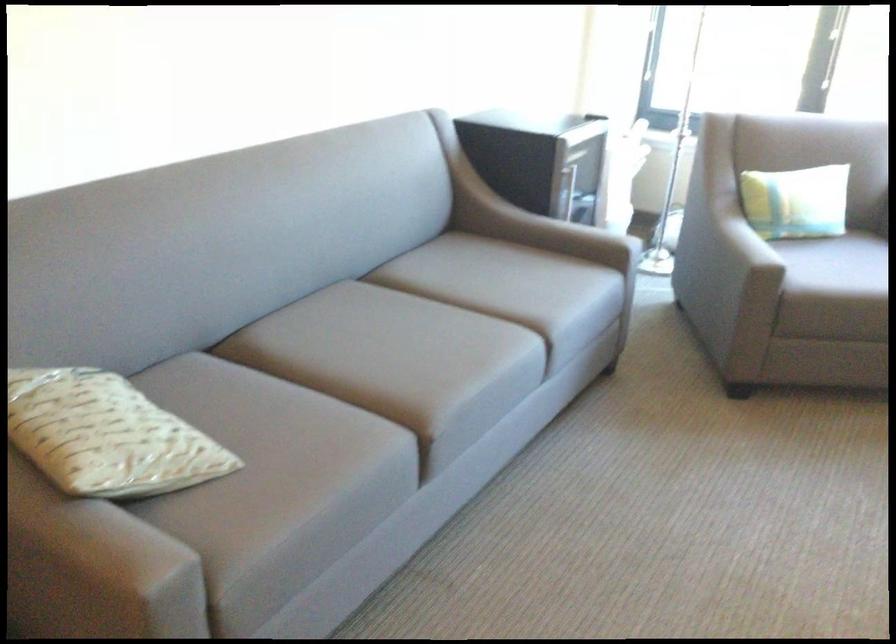
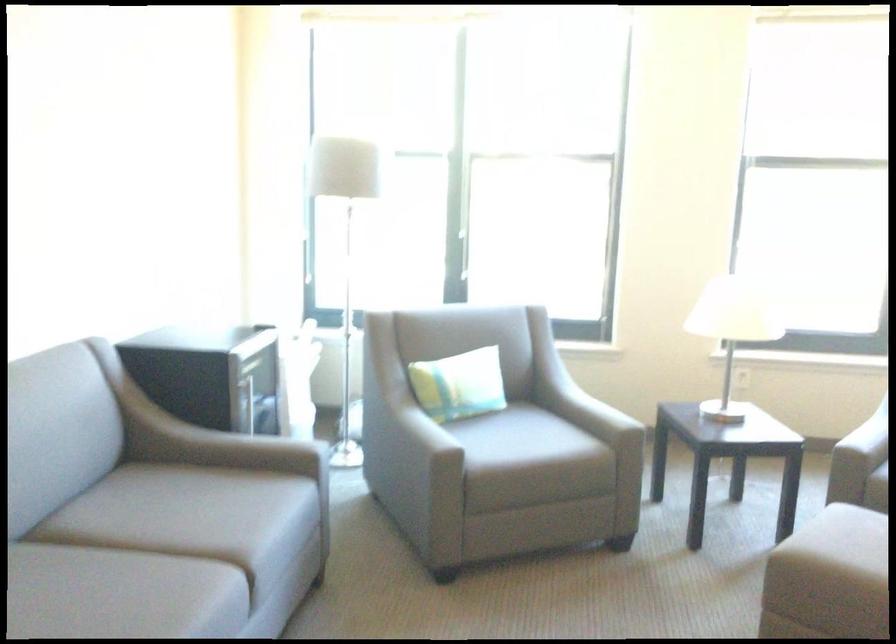
In the second image, find the point that corresponds to point 532,222 in the first image.

(211, 444)